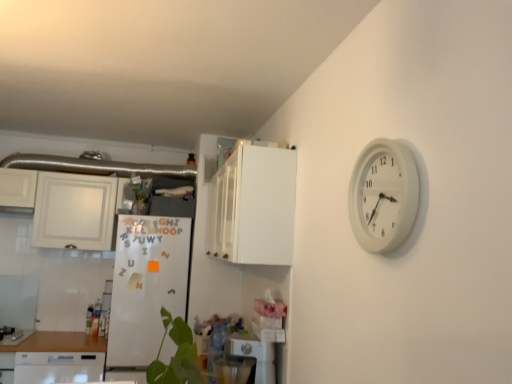
Question: From the image's perspective, relative to white plastic dishwasher at lower center, is brushed metal gas stove at lower left above or below?

Choices:
 (A) below
 (B) above

Answer: (A)

Question: From a real-world perspective, relative to white plastic dishwasher at lower center, is brushed metal gas stove at lower left vertically above or below?

Choices:
 (A) below
 (B) above

Answer: (A)

Question: Based on their relative distances, which object is farther from the white glossy cabinet at upper center, acting as the 1th cabinetry starting from the right?

Choices:
 (A) brushed metal gas stove at lower left
 (B) white glossy cabinet at upper left, placed as the second cabinetry when sorted from front to back
 (C) white plastic dishwasher at lower center
 (D) white glossy dishwasher at lower left
 (E) white matte refrigerator at center-left

Answer: (A)

Question: Which of these objects is positioned closest to the white glossy dishwasher at lower left?

Choices:
 (A) white plastic dishwasher at lower center
 (B) white plastic wall clock at upper right
 (C) brushed metal gas stove at lower left
 (D) white glossy cabinet at upper left, marked as the first cabinetry in a left-to-right arrangement
 (E) white matte refrigerator at center-left

Answer: (E)